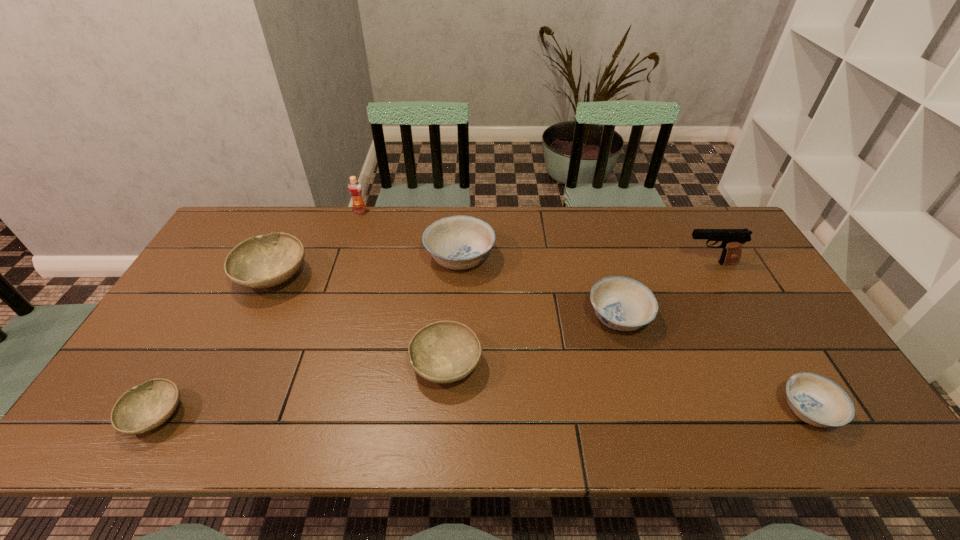
Find the location of `free spot located on the back of the smallest blue bowl`. free spot located on the back of the smallest blue bowl is located at coordinates (763, 333).

Locate an element on the screen. free region located on the back of the smallest gray bowl is located at coordinates (203, 334).

You are a GUI agent. You are given a task and a screenshot of the screen. Output one action in this format:
    pyautogui.click(x=<x>, y=<y>)
    Task: Click on the orange juice that is at the far edge
    Image resolution: width=960 pixels, height=540 pixels.
    Given the screenshot: What is the action you would take?
    pyautogui.click(x=354, y=187)

Identify the location of bowl that is positioned at the far edge. This screenshot has width=960, height=540. (459, 242).

Find the location of `pistol that is positioned at the right edge`. pistol that is positioned at the right edge is located at coordinates (732, 240).

Where is `bowl located in the right edge section of the desktop`? bowl located in the right edge section of the desktop is located at coordinates (818, 401).

At what (x,y) coordinates should I click in order to perform the action: click on object that is at the near left corner. Please return your answer as a coordinate pair (x, y). This screenshot has width=960, height=540. Looking at the image, I should click on (144, 407).

Image resolution: width=960 pixels, height=540 pixels. What are the coordinates of `object that is at the near right corner` in the screenshot? It's located at (818, 401).

At what (x,y) coordinates should I click in order to perform the action: click on blank space at the far edge. Please return your answer as a coordinate pair (x, y). The height and width of the screenshot is (540, 960). Looking at the image, I should click on (458, 208).

Identify the location of vacant area at the near edge of the desktop. The height and width of the screenshot is (540, 960). (588, 408).